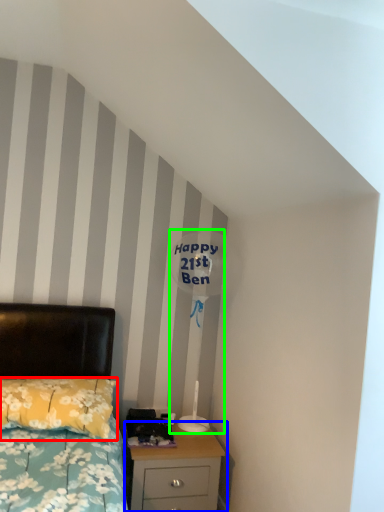
Question: Which is nearer to the pillow (highlighted by a red box)? nightstand (highlighted by a blue box) or table lamp (highlighted by a green box).

Choices:
 (A) nightstand
 (B) table lamp

Answer: (A)